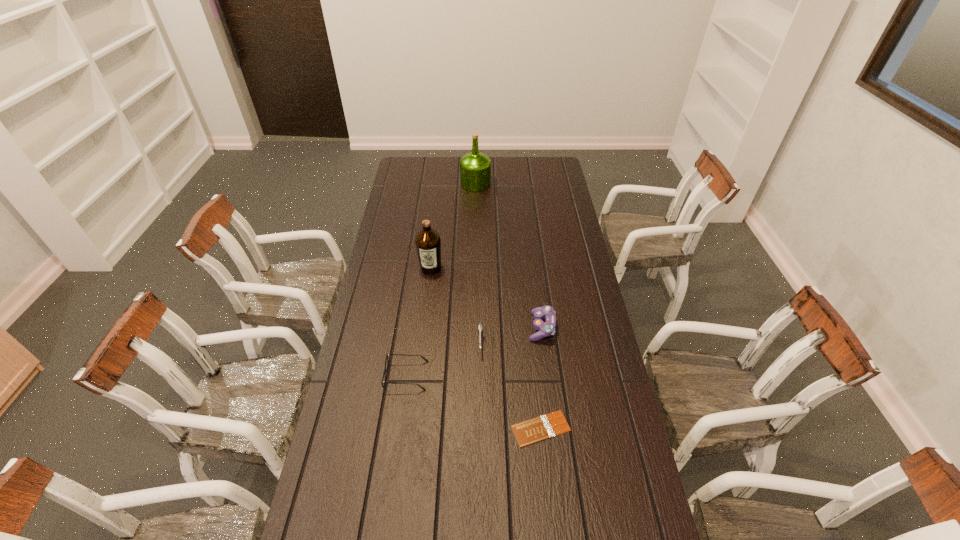
The width and height of the screenshot is (960, 540). I want to click on free space between the farthest object and the pistol, so click(478, 262).

Image resolution: width=960 pixels, height=540 pixels. Find the location of `object that stands as the closest to the shorter olive oil`. object that stands as the closest to the shorter olive oil is located at coordinates (480, 328).

Point out which object is positioned as the third nearest to the fifth farthest object. Please provide its 2D coordinates. Your answer should be formatted as a tuple, i.e. [(x, y)], where the tuple contains the x and y coordinates of a point satisfying the conditions above.

[(547, 328)]

Locate an element on the screen. blank space that satisfies the following two spatial constraints: 1. on the back side of the chocolate bar; 2. with the lenses facing outward on the fifth tallest object is located at coordinates (536, 376).

At what (x,y) coordinates should I click in order to perform the action: click on vacant space that satisfies the following two spatial constraints: 1. on the label of the nearer olive oil; 2. on the left side of the chocolate bar. Please return your answer as a coordinate pair (x, y). The height and width of the screenshot is (540, 960). Looking at the image, I should click on (412, 428).

Where is `blank area in the image that satisfies the following two spatial constraints: 1. on the label of the left olive oil; 2. with the lenses facing outward on the second shortest object`? This screenshot has height=540, width=960. blank area in the image that satisfies the following two spatial constraints: 1. on the label of the left olive oil; 2. with the lenses facing outward on the second shortest object is located at coordinates (418, 376).